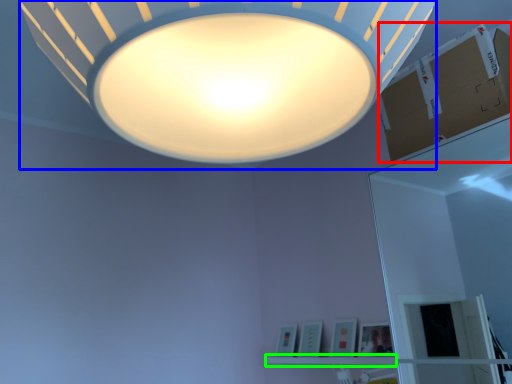
Question: Which is nearer to the cardboard box (highlighted by a red box)? lamp (highlighted by a blue box) or shelf (highlighted by a green box).

Choices:
 (A) lamp
 (B) shelf

Answer: (A)